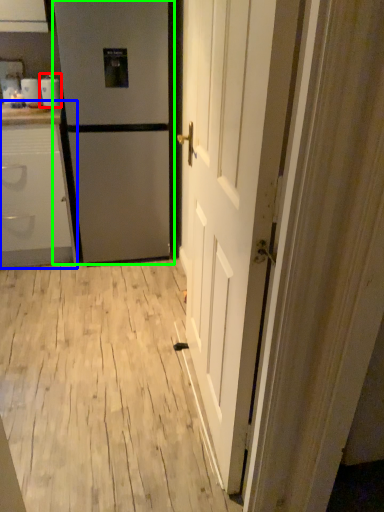
Question: Which object is the closest to the appliance (highlighted by a red box)? Choose among these: cabinetry (highlighted by a blue box) or refrigerator (highlighted by a green box).

Choices:
 (A) cabinetry
 (B) refrigerator

Answer: (B)